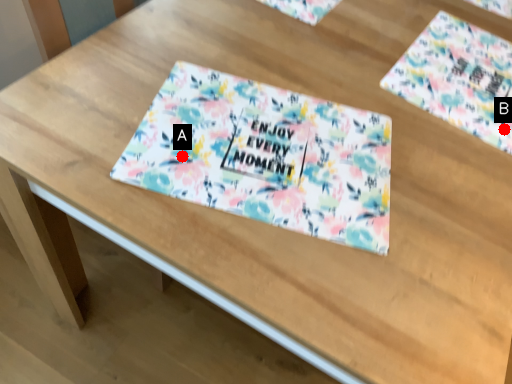
Question: Two points are circled on the image, labeled by A and B beside each circle. Among these points, which one is nearest to the camera?

Choices:
 (A) A is closer
 (B) B is closer

Answer: (A)